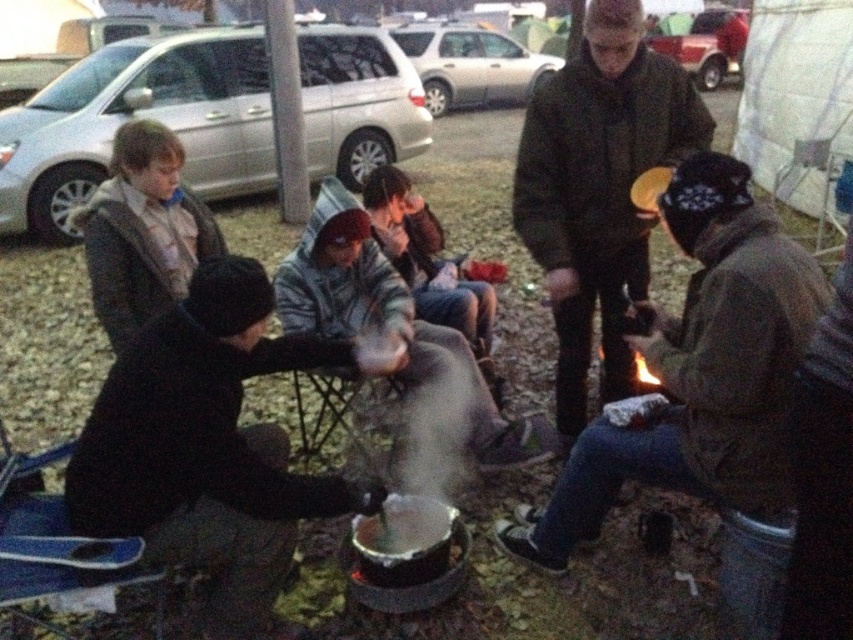
You are planning to cook a meal for a group of people at the campfire scene. The black matte pot at lower left and the dark brown leather jacket at center are present. Which object has a greater width and why?

The black matte pot at lower left has a greater width than the dark brown leather jacket at center because the description states that the black matte pot at lower left is wider.